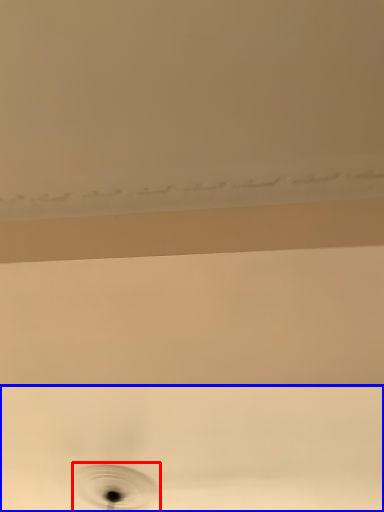
Question: Which of the following is the closest to the observer, hole (highlighted by a red box) or plumbing fixture (highlighted by a blue box)?

Choices:
 (A) hole
 (B) plumbing fixture

Answer: (B)